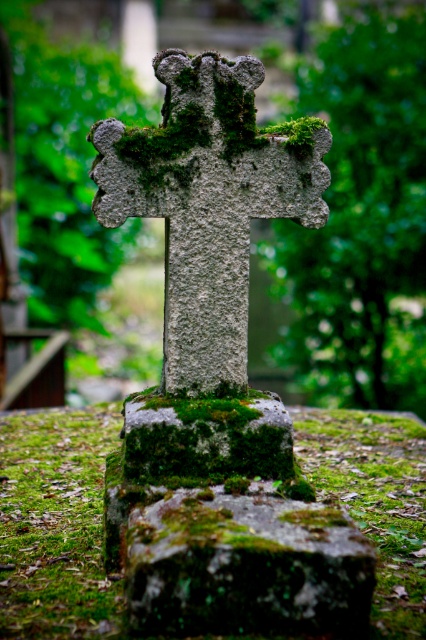
Does mossy stone cross at center appear under green mossy stone at center?

Incorrect, mossy stone cross at center is not positioned below green mossy stone at center.

Can you confirm if mossy stone cross at center is bigger than green mossy stone at center?

Correct, mossy stone cross at center is larger in size than green mossy stone at center.

Is point (178, 172) positioned after point (333, 566)?

That is True.

Find the location of a particular element. The height and width of the screenshot is (640, 426). mossy stone cross at center is located at coordinates (209, 202).